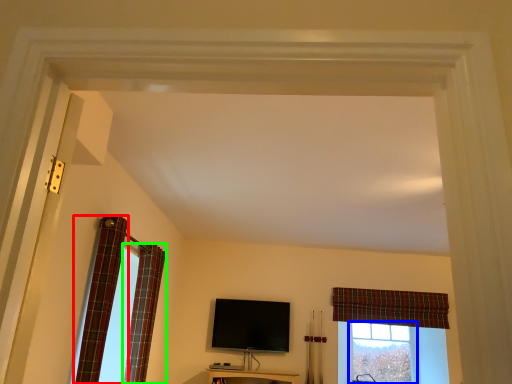
Question: Based on their relative distances, which object is nearer to curtain (highlighted by a red box)? Choose from bay window (highlighted by a blue box) and curtain (highlighted by a green box).

Choices:
 (A) bay window
 (B) curtain

Answer: (B)